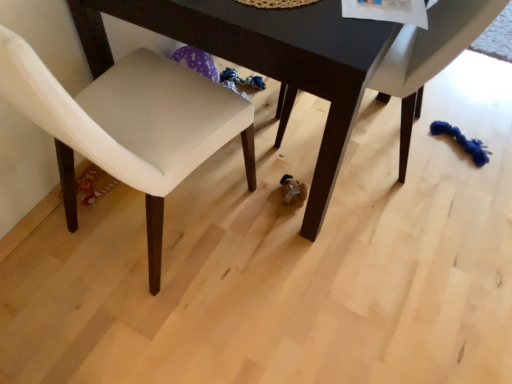
Question: From the image's perspective, is dark wood table at center above or below white fabric chair at lower right, which is the 1th chair in right-to-left order?

Choices:
 (A) above
 (B) below

Answer: (A)

Question: From their relative heights in the image, would you say dark wood table at center is taller or shorter than white fabric chair at lower right, which is counted as the 2th chair, starting from the left?

Choices:
 (A) short
 (B) tall

Answer: (B)

Question: Which is farther from the dark wood table at center?

Choices:
 (A) white fabric chair at lower right, which is counted as the 2th chair, starting from the left
 (B) white leather chair at lower left, which is counted as the first chair, starting from the left

Answer: (A)

Question: Considering the real-world distances, which object is closest to the white leather chair at lower left, the 2th chair in the right-to-left sequence?

Choices:
 (A) white fabric chair at lower right, which is the 1th chair in right-to-left order
 (B) dark wood table at center

Answer: (B)